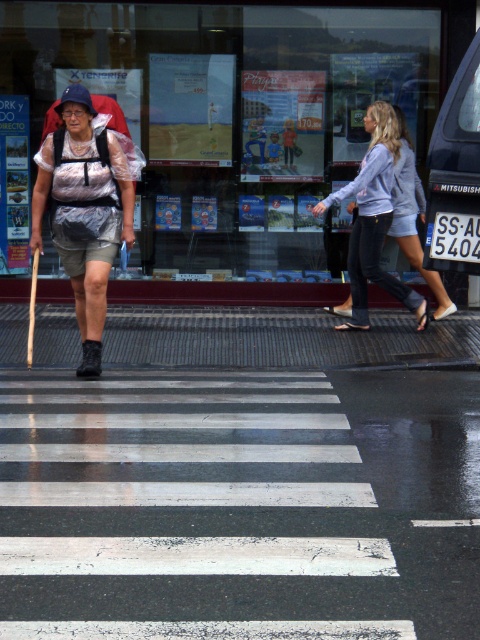
From the picture: Is matte plastic bag at center smaller than denim shorts at center?

Indeed, matte plastic bag at center has a smaller size compared to denim shorts at center.

Based on the photo, does matte plastic bag at center come in front of denim shorts at center?

Yes, matte plastic bag at center is closer to the viewer.

Who is more forward, [81,124] or [362,275]?

Point [81,124] is more forward.

I want to click on matte plastic bag at center, so click(84, 209).